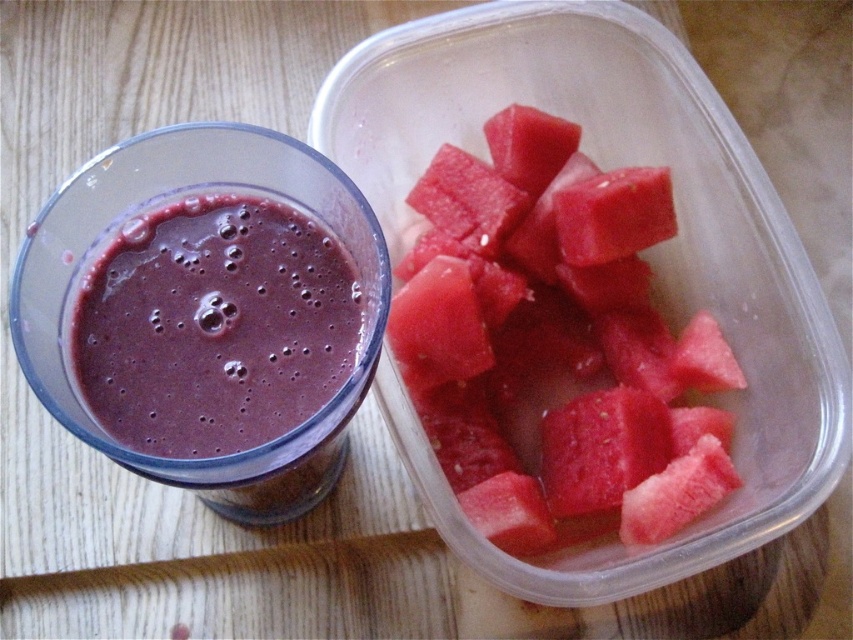
You are organizing a picnic basket and need to know which item is taller between the red matte watermelon at upper right and the purple smoothie at left. Based on the scene, which one is taller?

The red matte watermelon at upper right is taller than the purple smoothie at left according to the description.

You are arranging items on a wooden surface. You have a glass of smoothie and a red matte watermelon at upper right. Based on their positions, which item is closer to the top edge of the surface?

The red matte watermelon at upper right is closer to the top edge of the surface because its position at point (x=556, y=342) places it higher up compared to the glass of smoothie.

You are a food delivery person who needs to pick up the glass of smoothie and the plastic container with watermelon cubes. The delivery requires you to carry both items to the customer. However, there is a small obstacle at point (556, 342). Can you safely move around this obstacle while carrying both items?

The obstacle at point (556, 342) is the red matte watermelon at upper right. Since the watermelon is part of the items to be delivered, you should pick it up along with the glass of smoothie and carry both items carefully to avoid spilling the smoothie or damaging the watermelon cubes.